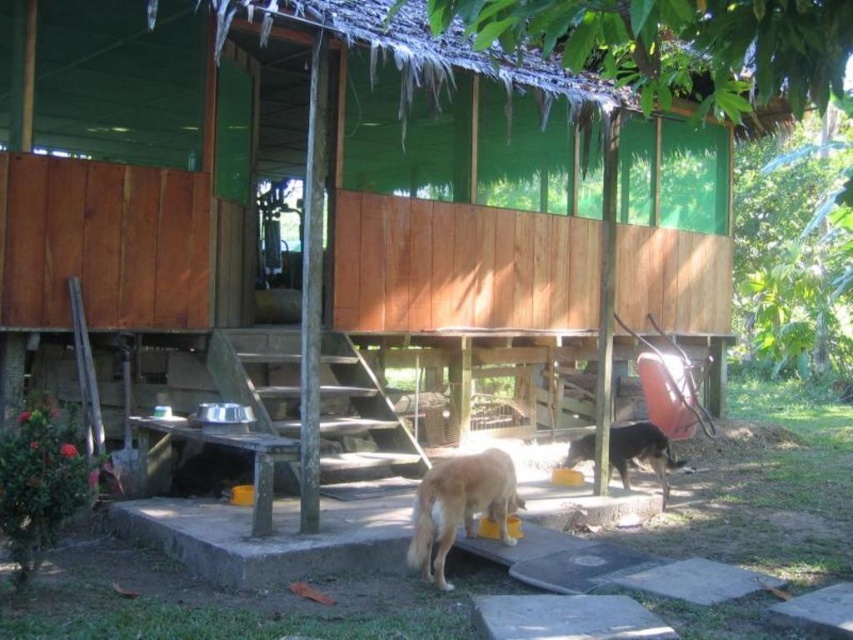
Question: Considering the relative positions of golden fur dog at lower center and brown fur dog at lower center in the image provided, where is golden fur dog at lower center located with respect to brown fur dog at lower center?

Choices:
 (A) left
 (B) right

Answer: (A)

Question: Among these objects, which one is nearest to the camera?

Choices:
 (A) brown fur dog at lower center
 (B) golden fur dog at lower center

Answer: (B)

Question: Among these points, which one is farthest from the camera?

Choices:
 (A) (456, 465)
 (B) (572, 451)

Answer: (B)

Question: Is golden fur dog at lower center below brown fur dog at lower center?

Choices:
 (A) yes
 (B) no

Answer: (B)

Question: Which object appears farthest from the camera in this image?

Choices:
 (A) golden fur dog at lower center
 (B) brown fur dog at lower center

Answer: (B)

Question: Is golden fur dog at lower center further to camera compared to brown fur dog at lower center?

Choices:
 (A) no
 (B) yes

Answer: (A)